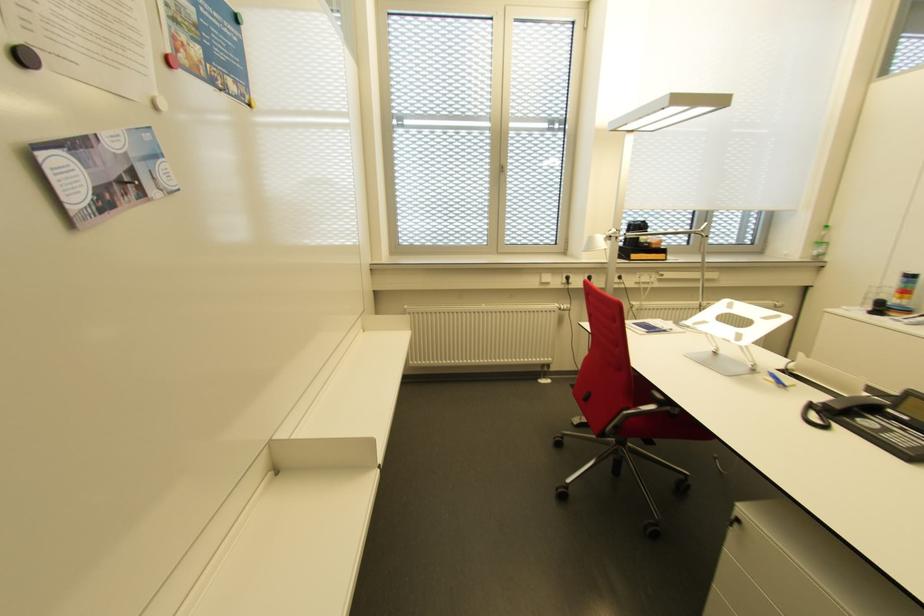
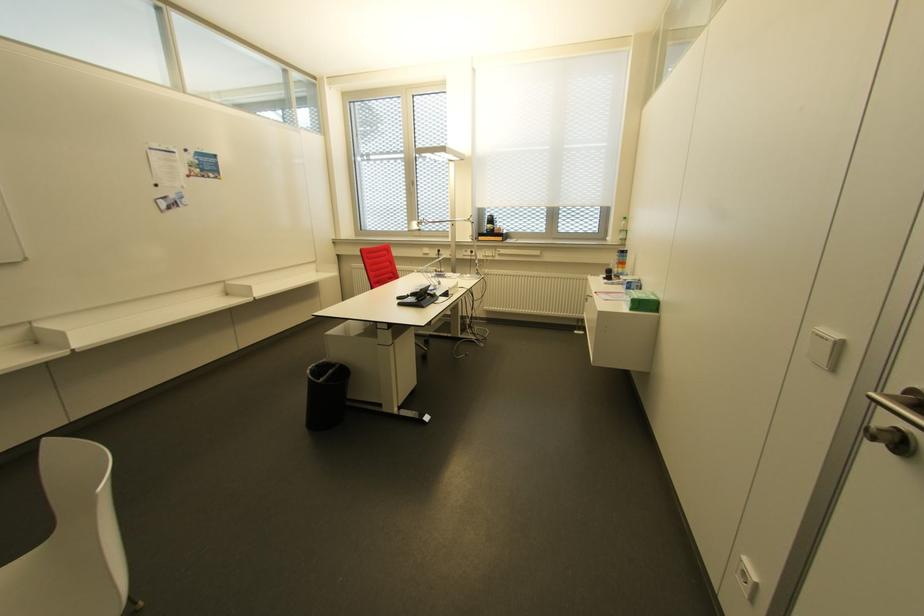
The point at (820,254) is marked in the first image. Where is the corresponding point in the second image?

(623, 240)